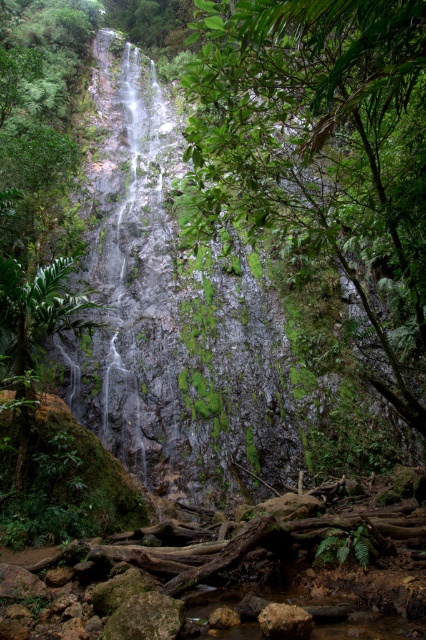
Question: From the image, what is the correct spatial relationship of green mossy rock at center in relation to green mossy rock at lower center?

Choices:
 (A) below
 (B) above

Answer: (B)

Question: Where is green mossy rock at center located in relation to rusty metallic rock at lower center in the image?

Choices:
 (A) right
 (B) left

Answer: (A)

Question: Which object is closer to the camera taking this photo?

Choices:
 (A) green mossy rock at lower center
 (B) rusty metallic rock at lower center

Answer: (A)

Question: Among these objects, which one is nearest to the camera?

Choices:
 (A) green mossy rock at center
 (B) rusty metallic rock at lower center

Answer: (A)

Question: Does green mossy rock at center appear on the left side of green mossy rock at lower center?

Choices:
 (A) yes
 (B) no

Answer: (B)

Question: Which of the following is the closest to the observer?

Choices:
 (A) (279, 637)
 (B) (356, 131)

Answer: (A)